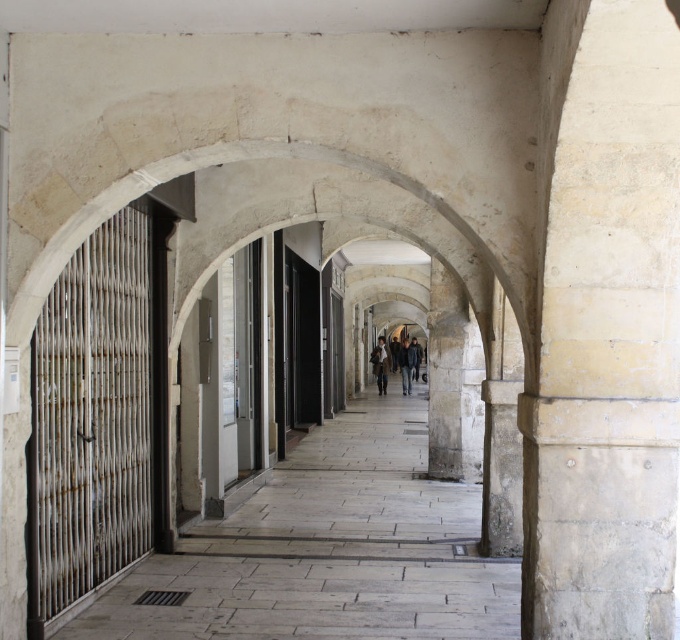
You are a delivery person who needs to deliver a package to the shop behind the metal bars on the left. You see a dark gray coat at center and a light brown leather jacket at center. Which item is blocking the view of the shop more?

The dark gray coat at center is positioned over light brown leather jacket at center, so it is blocking the view of the shop more.